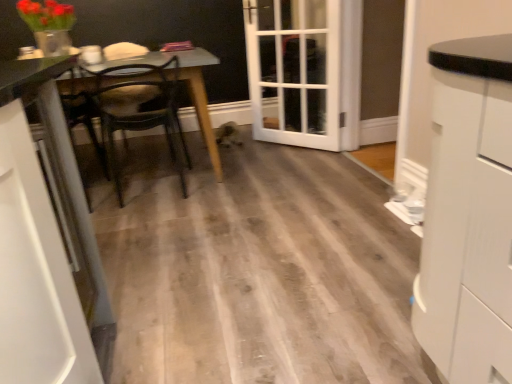
Where is `vacant space in between white glass door at center and wooden table at left`? This screenshot has height=384, width=512. vacant space in between white glass door at center and wooden table at left is located at coordinates [262, 152].